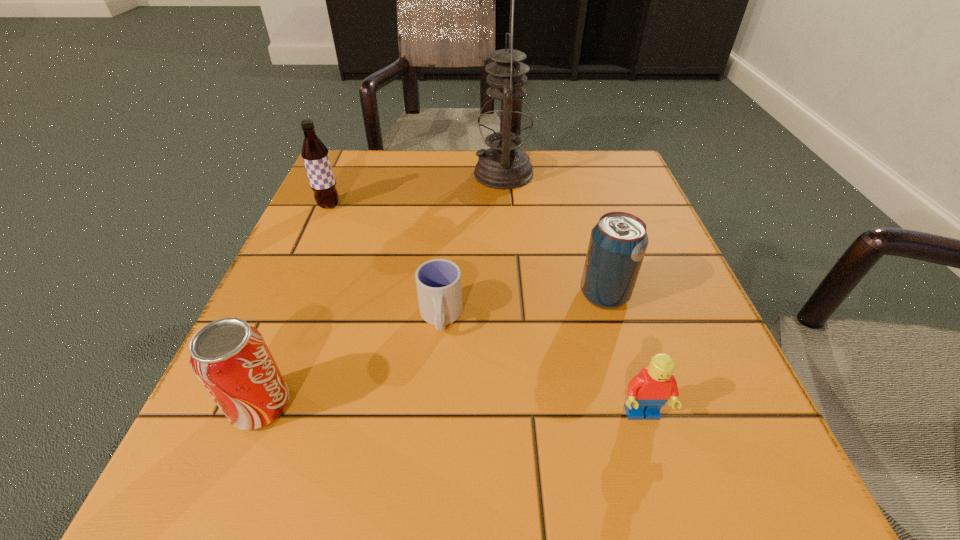
Locate an element on the screen. object that is the fourth closest to the fifth shortest object is located at coordinates (x=618, y=242).